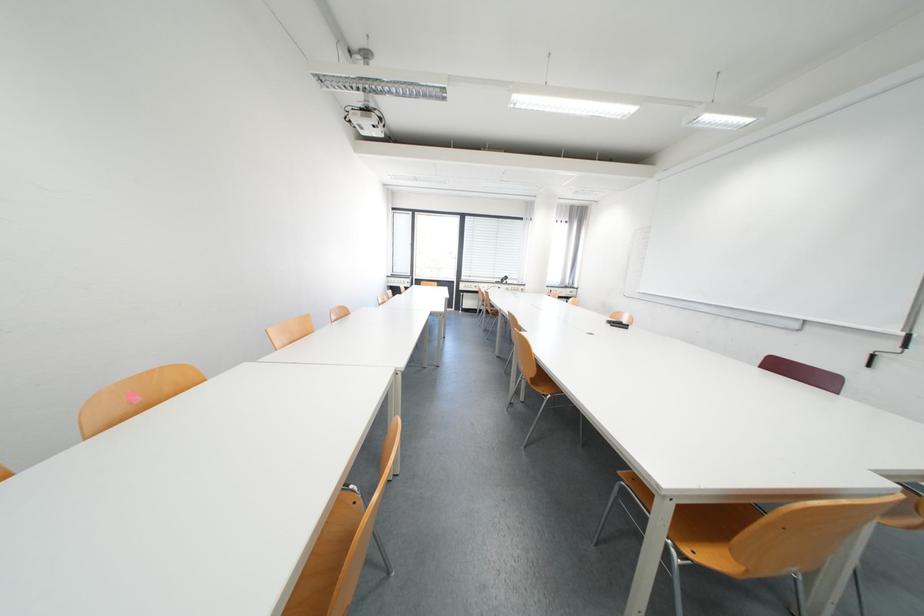
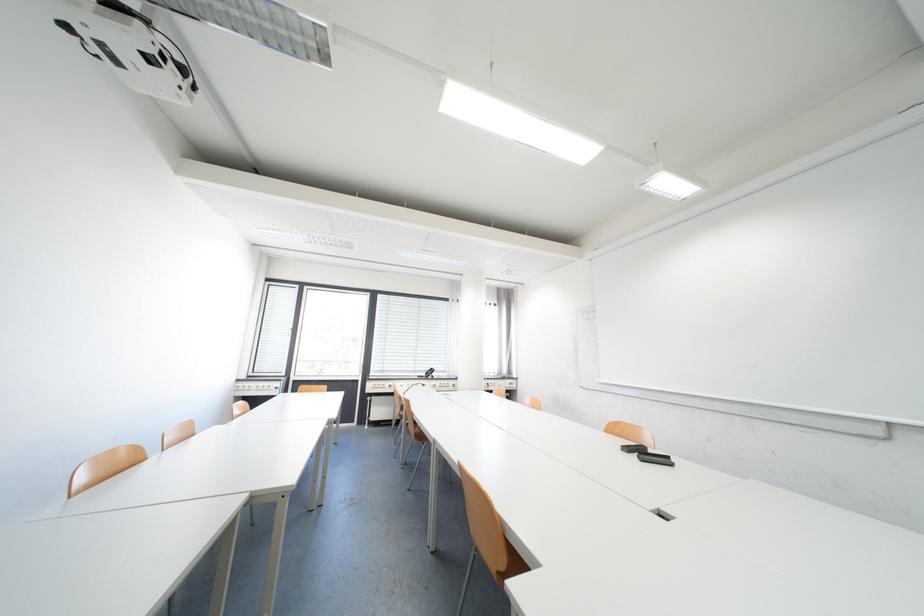
The point at (504, 278) is marked in the first image. Where is the corresponding point in the second image?

(426, 371)